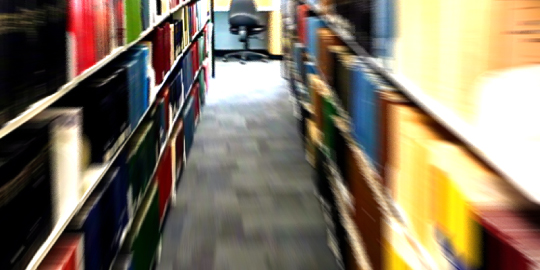
Locate an element on the screen. blue books is located at coordinates (364, 114), (389, 25), (148, 82).